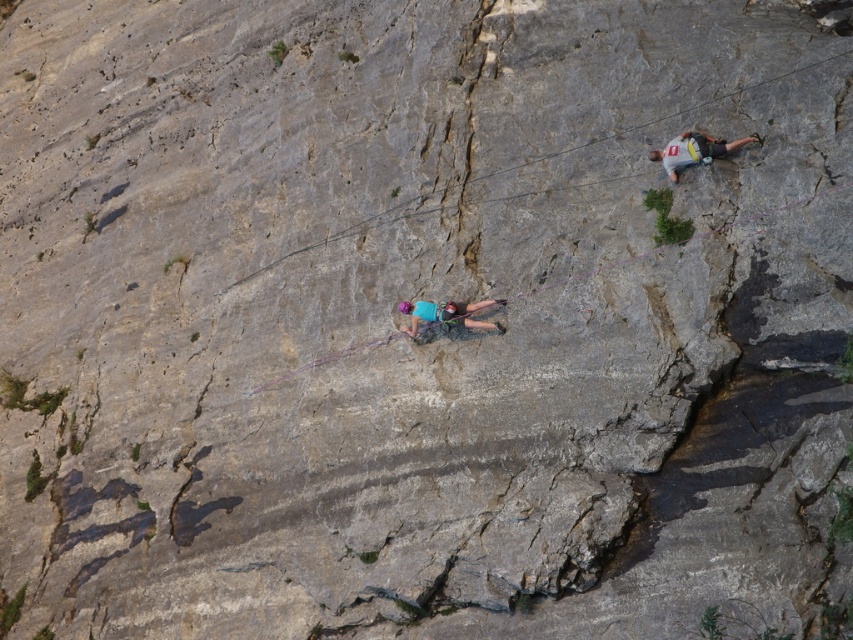
You are a safety inspector reviewing the rock climbing scene. The safety protocol requires that the helmet must be worn by the climber. Based on the coordinates provided in the Objects Description, can you confirm if the matte purple helmet at center is positioned correctly on the climber?

The matte purple helmet at center is located at point (445, 320), which aligns with the correct position on the climber, so it is properly worn.

You are a photographer positioned below the cliff. You want to take a photo that includes both the matte purple helmet at center and the gray fabric shirt at upper right. Which object should you adjust your camera to focus on first to ensure both are in frame?

The matte purple helmet at center is to the left of gray fabric shirt at upper right. Since the matte purple helmet is positioned to the left, you should focus on the matte purple helmet at center first to ensure both objects are within the camera frame.

Looking at this image, you are a safety inspector reviewing this rock climbing scene. You notice the matte purple helmet at center and the gray fabric shirt at upper right. Based on their positions, which object is lower in the climbing route?

The matte purple helmet at center is located below the gray fabric shirt at upper right, so the matte purple helmet at center is lower in the climbing route.